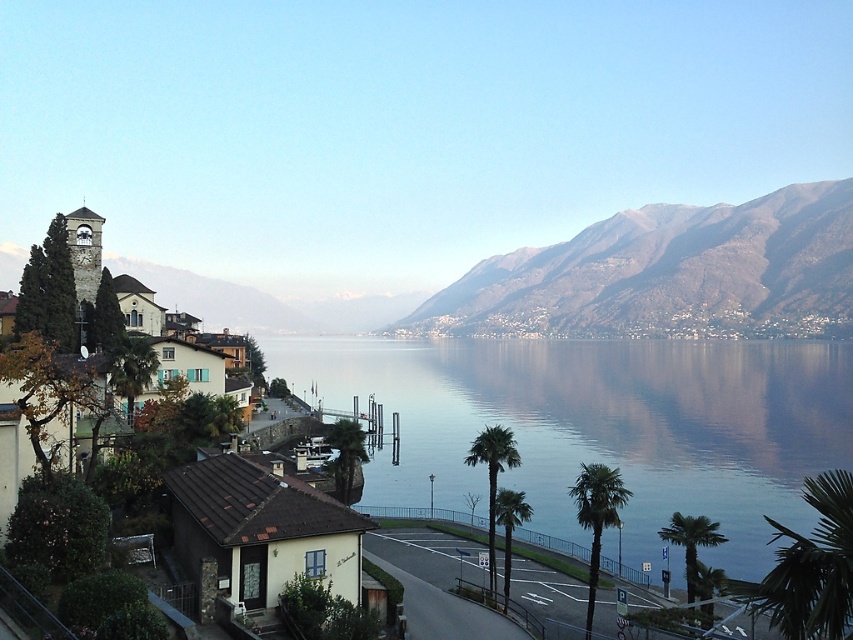
Can you confirm if gray rocky mountains at upper right is smaller than green leafy palm trees at center?

No, gray rocky mountains at upper right is not smaller than green leafy palm trees at center.

Is point (566, 285) positioned in front of point (494, 509)?

No, (566, 285) is further to viewer.

Find the location of a particular element. The image size is (853, 640). gray rocky mountains at upper right is located at coordinates (669, 275).

Does transparent water at center have a smaller size compared to gray rocky mountains at upper right?

Correct, transparent water at center occupies less space than gray rocky mountains at upper right.

What do you see at coordinates (601, 426) in the screenshot? I see `transparent water at center` at bounding box center [601, 426].

The width and height of the screenshot is (853, 640). I want to click on transparent water at center, so click(601, 426).

Does transparent water at center come in front of green leafy palm tree at center-right?

No, transparent water at center is further to the viewer.

Measure the distance between transparent water at center and green leafy palm tree at center-right.

transparent water at center and green leafy palm tree at center-right are 138.83 meters apart.

Does point (440, 358) lie behind point (584, 477)?

That is True.

You are a GUI agent. You are given a task and a screenshot of the screen. Output one action in this format:
    pyautogui.click(x=<x>, y=<y>)
    Task: Click on the transparent water at center
    This screenshot has width=853, height=640.
    Given the screenshot: What is the action you would take?
    pyautogui.click(x=601, y=426)